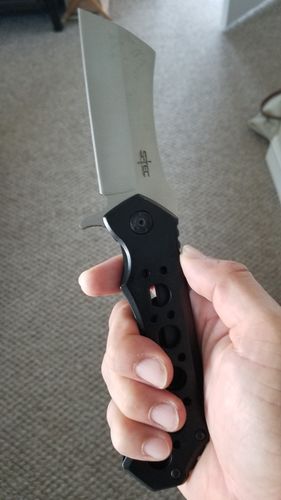
Where is `door`? door is located at coordinates (237, 8).